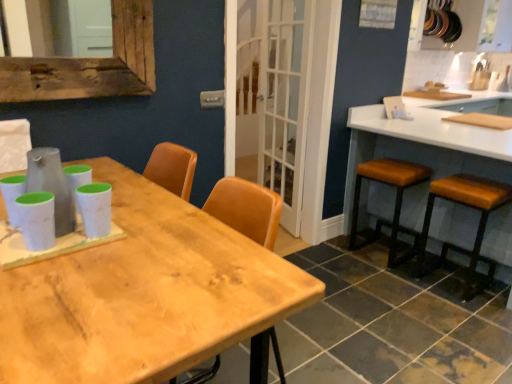
This screenshot has width=512, height=384. I want to click on vacant region below brown leather stool at right, which is counted as the 1th stool, starting from the left (from a real-world perspective), so click(370, 261).